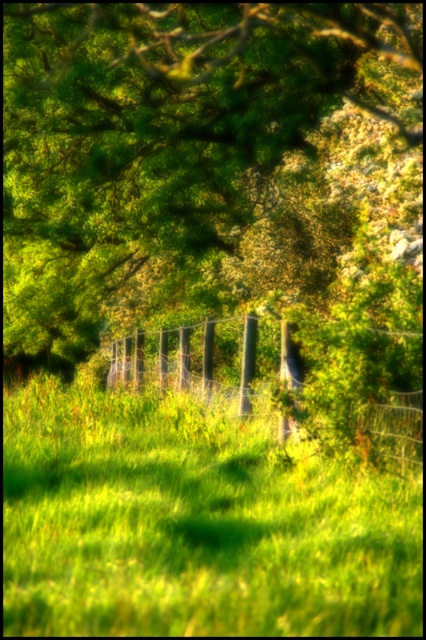
From the picture: You are a gardener who wants to place a new flower pot between the green grassy at center and the smooth black pole at center. The flower pot requires 1.5 meters of space to be placed. Can you fit it between them?

The distance between the green grassy at center and the smooth black pole at center is 2.88 meters. Since the flower pot needs 1.5 meters of space, there is enough space to place it between them as 2.88 meters is greater than 1.5 meters.

You are standing in the middle of the green grassy at center and want to take a photo of the green leafy tree at upper center. Will the tree be fully visible in the photo if you stand there?

The green leafy tree at upper center is taller than the green grassy at center, so yes, the tree will be fully visible in the photo when you stand there because its height surpasses the grass.